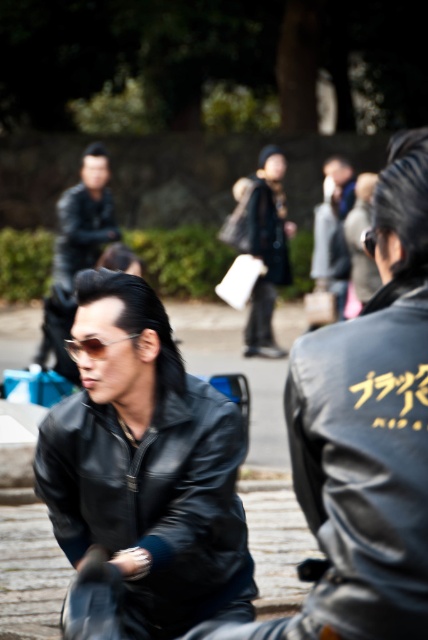
Question: Is black leather jacket at center below matte black leather jacket at upper left?

Choices:
 (A) yes
 (B) no

Answer: (A)

Question: Does matte black leather jacket at center have a lesser width compared to matte black leather jacket at upper left?

Choices:
 (A) yes
 (B) no

Answer: (B)

Question: Which of these objects is positioned farthest from the matte black goggles at center?

Choices:
 (A) matte black leather jacket at upper left
 (B) matte black leather jacket at center
 (C) black leather jacket at center

Answer: (A)

Question: Which point appears closest to the camera in this image?

Choices:
 (A) (98, 173)
 (B) (91, 346)

Answer: (B)

Question: Which object appears closest to the camera in this image?

Choices:
 (A) black leather jacket at center
 (B) matte black goggles at center
 (C) matte black leather jacket at upper left
 (D) matte black leather jacket at center

Answer: (A)

Question: Does matte black leather jacket at upper left appear under matte black goggles at center?

Choices:
 (A) yes
 (B) no

Answer: (B)